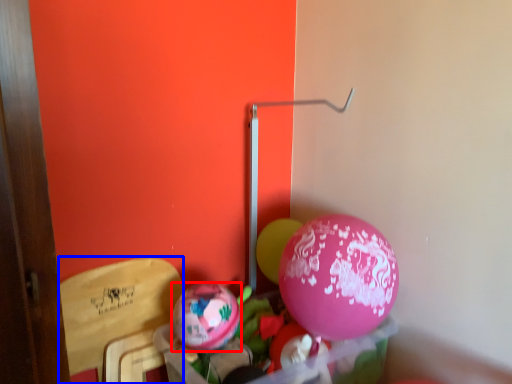
Question: Which point is further to the camera, balloon (highlighted by a red box) or armchair (highlighted by a blue box)?

Choices:
 (A) balloon
 (B) armchair

Answer: (A)